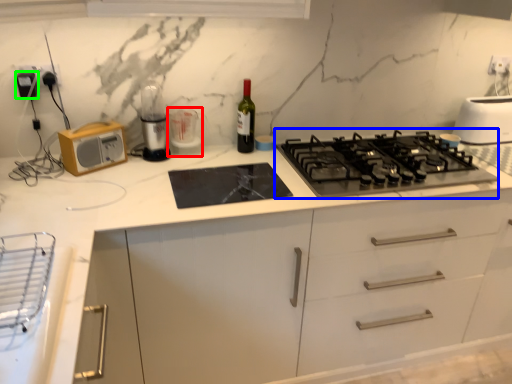
Question: Which is nearer to the appliance (highlighted by a red box)? gas stove (highlighted by a blue box) or appliance (highlighted by a green box).

Choices:
 (A) gas stove
 (B) appliance

Answer: (B)